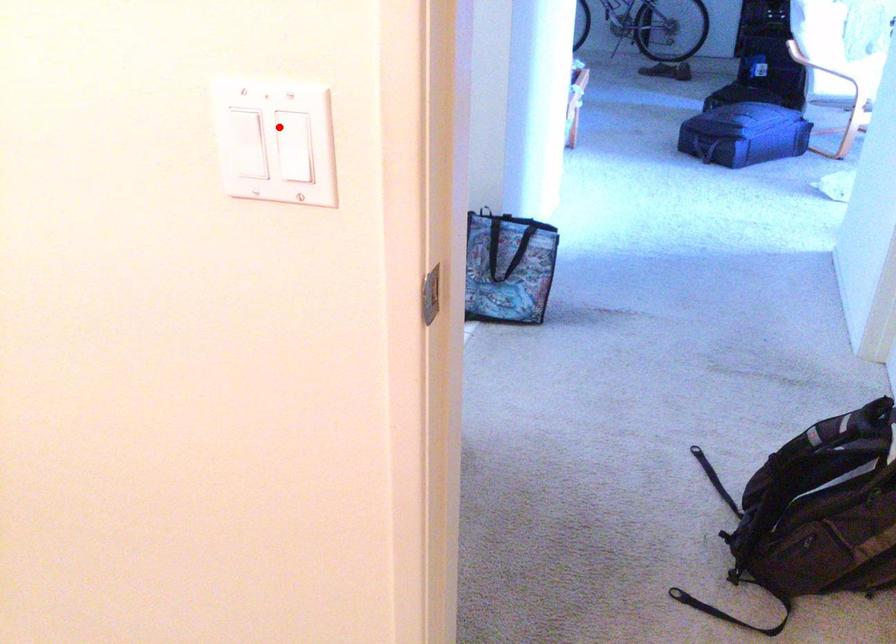
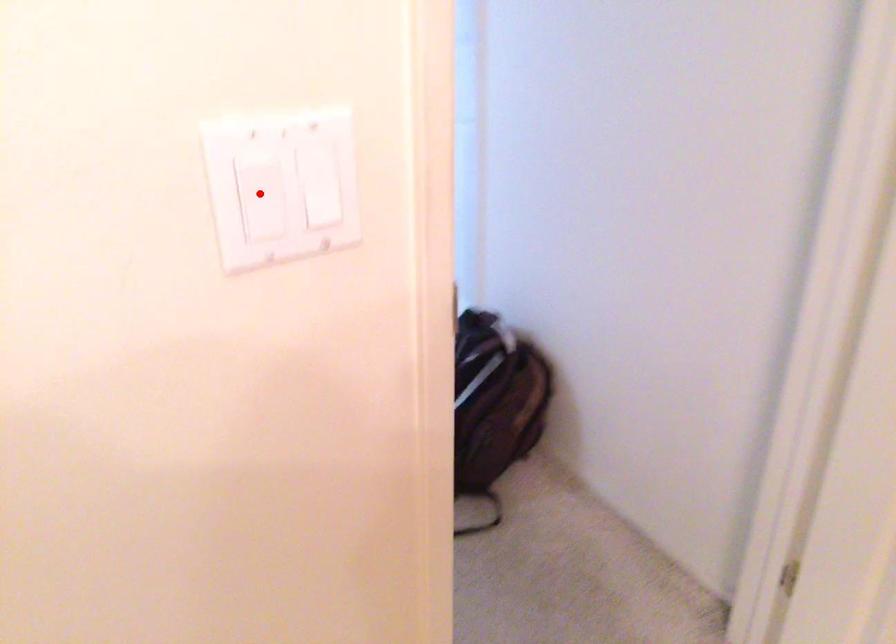
I am providing you with two images of the same scene from different viewpoints. A red point is marked on the first image and another point is marked on the second image. Is the red point in image1 aligned with the point shown in image2?

No